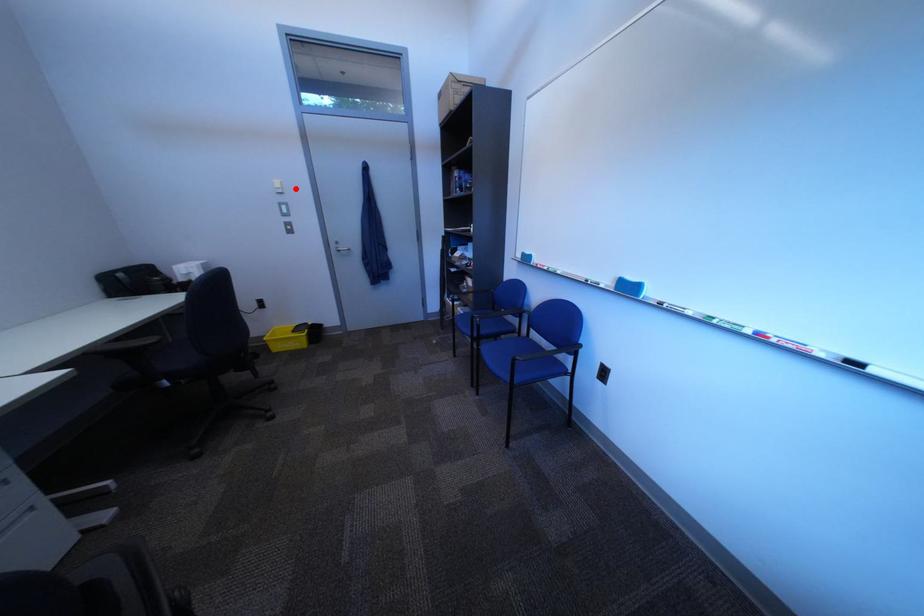
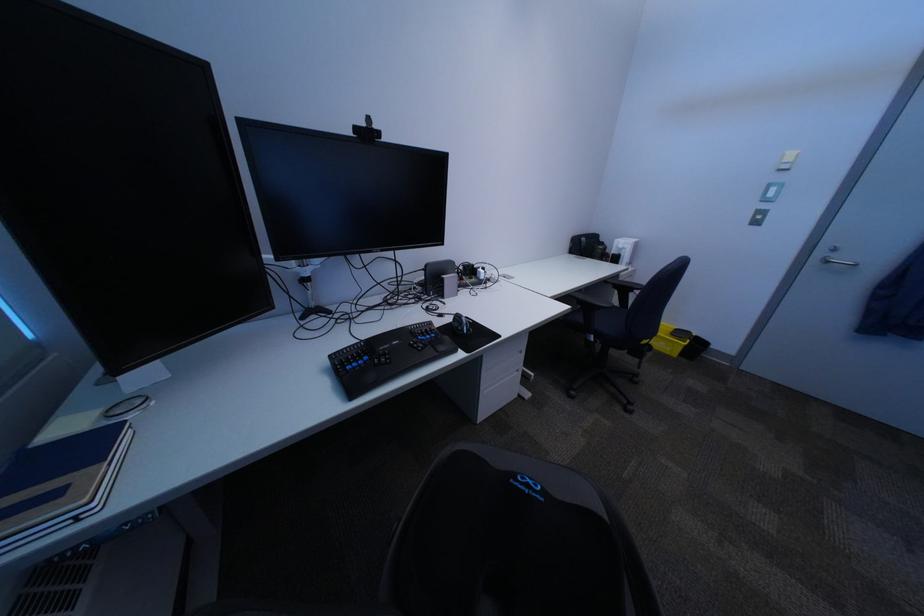
Question: I am providing you with two images of the same scene from different viewpoints. Given a red point in image1, look at the same physical point in image2. Is it:

Choices:
 (A) Closer to the viewpoint
 (B) Farther from the viewpoint

Answer: (B)